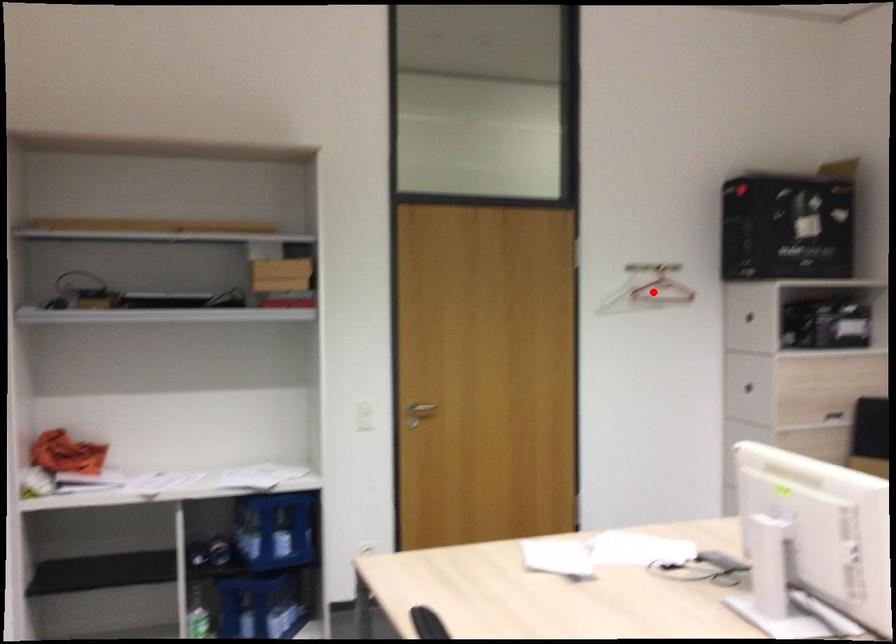
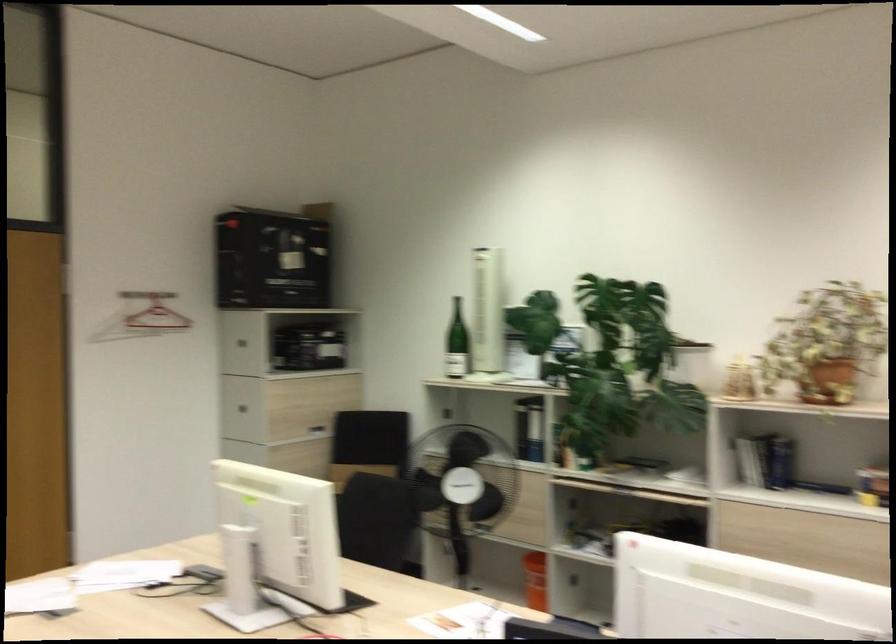
Where in the second image is the point corresponding to the highlighted location from the first image?

(142, 317)